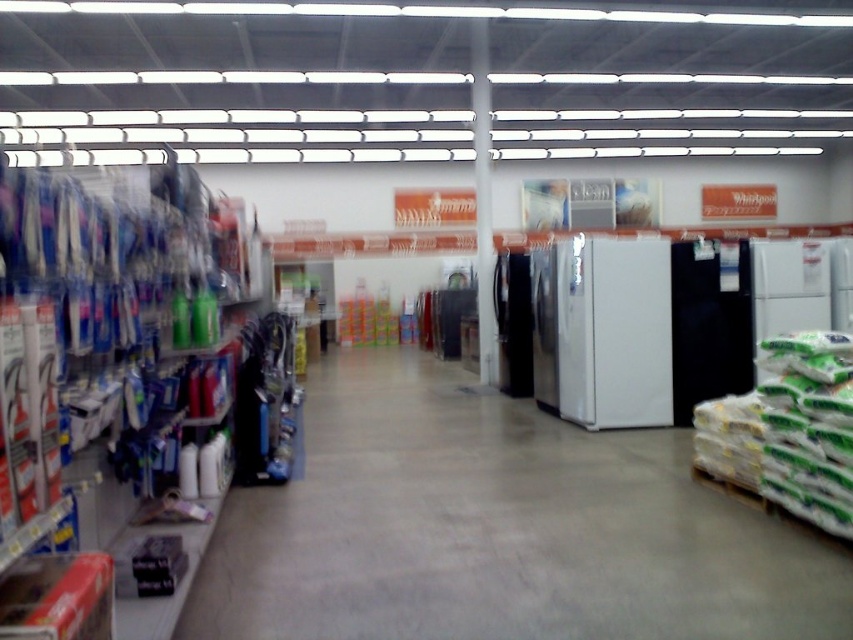
Between white glossy pillar at center and satin silver refrigerator at center, which one appears on the right side from the viewer's perspective?

From the viewer's perspective, satin silver refrigerator at center appears more on the right side.

Can you confirm if white glossy pillar at center is smaller than satin silver refrigerator at center?

Incorrect, white glossy pillar at center is not smaller in size than satin silver refrigerator at center.

Describe the element at coordinates (483, 202) in the screenshot. This screenshot has width=853, height=640. I see `white glossy pillar at center` at that location.

In order to click on white glossy pillar at center in this screenshot , I will do `click(483, 202)`.

Between black matte refrigerator at right and satin black refrigerator at center, which one appears on the left side from the viewer's perspective?

From the viewer's perspective, satin black refrigerator at center appears more on the left side.

Between point (691, 252) and point (512, 316), which one is positioned behind?

The point (512, 316) is more distant.

Between point (747, 266) and point (521, 262), which one is positioned behind?

The point (521, 262) is behind.

Locate an element on the screen. Image resolution: width=853 pixels, height=640 pixels. black matte refrigerator at right is located at coordinates (708, 326).

Between white plastic bottles at left and satin silver refrigerator at center, which one is positioned higher?

white plastic bottles at left

Measure the distance from white plastic bottles at left to satin silver refrigerator at center.

They are 3.98 meters apart.

Does point (57, 396) come closer to viewer compared to point (548, 364)?

That is True.

Where is `white plastic bottles at left`? white plastic bottles at left is located at coordinates (113, 324).